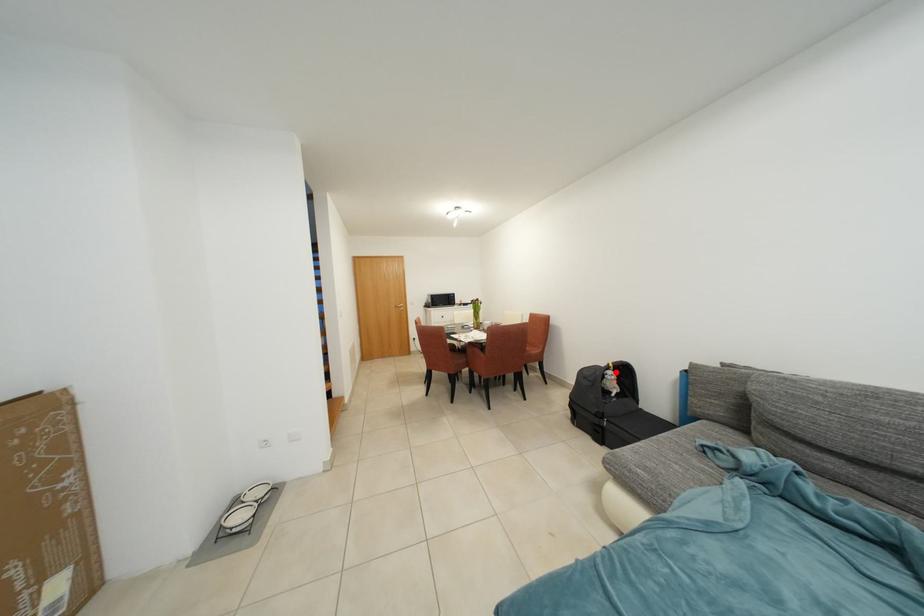
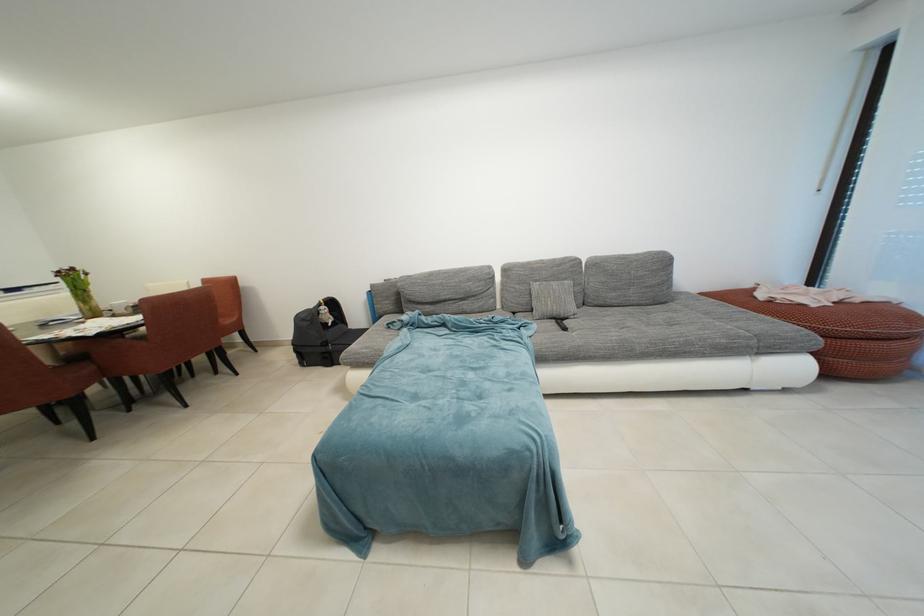
Locate, in the second image, the point that corresponds to the highlighted location in the first image.

(329, 309)